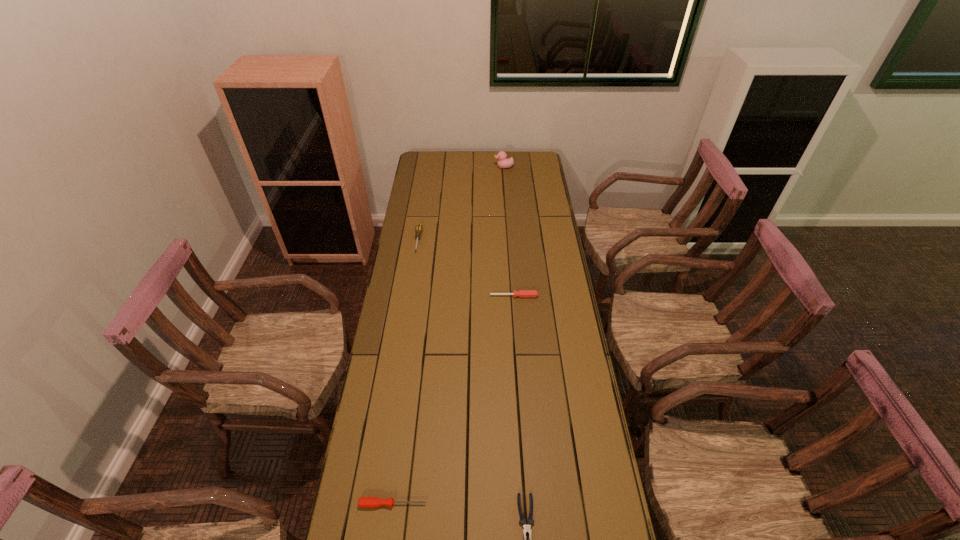
This screenshot has height=540, width=960. What are the coordinates of `vacant space located on the front-facing side of the duckling` in the screenshot? It's located at (467, 167).

Where is `vacant space located at the tip of the second farthest object`? The width and height of the screenshot is (960, 540). vacant space located at the tip of the second farthest object is located at coordinates (406, 316).

Locate an element on the screen. This screenshot has width=960, height=540. blank area located on the back of the second shortest screwdriver is located at coordinates (513, 271).

The height and width of the screenshot is (540, 960). I want to click on vacant space situated at the tip of the shortest screwdriver, so click(x=465, y=504).

I want to click on object that is at the far edge, so click(x=503, y=162).

This screenshot has height=540, width=960. In order to click on object that is at the right edge in this screenshot , I will do `click(522, 293)`.

Where is `free location at the far edge`? free location at the far edge is located at coordinates (482, 173).

Where is `free region at the left edge of the desktop`? The height and width of the screenshot is (540, 960). free region at the left edge of the desktop is located at coordinates tap(407, 326).

Image resolution: width=960 pixels, height=540 pixels. In the image, there is a desktop. What are the coordinates of `vacant space at the right edge` in the screenshot? It's located at (574, 427).

In the image, there is a desktop. Identify the location of vacant space at the far left corner. (442, 157).